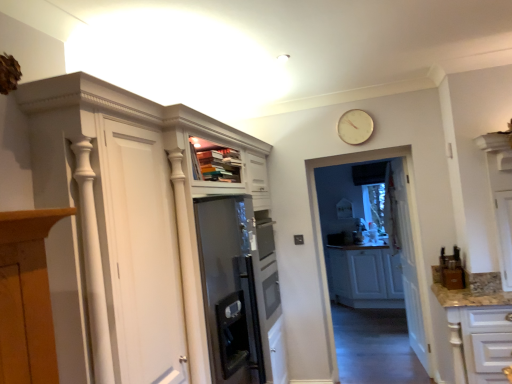
Question: Is transparent glass door at center oriented towards white glossy cupboard at upper left?

Choices:
 (A) yes
 (B) no

Answer: (B)

Question: Is the depth of transparent glass door at center less than that of white glossy cupboard at upper left?

Choices:
 (A) no
 (B) yes

Answer: (A)

Question: Is transparent glass door at center smaller than white glossy cupboard at upper left?

Choices:
 (A) no
 (B) yes

Answer: (B)

Question: From a real-world perspective, is transparent glass door at center located beneath white glossy cupboard at upper left?

Choices:
 (A) yes
 (B) no

Answer: (A)

Question: Is transparent glass door at center completely or partially outside of white glossy cupboard at upper left?

Choices:
 (A) yes
 (B) no

Answer: (A)

Question: Can you confirm if transparent glass door at center is positioned to the right of white glossy cupboard at upper left?

Choices:
 (A) yes
 (B) no

Answer: (A)

Question: Considering the relative sizes of white glossy cabinet at lower right, positioned as the second cabinetry in back-to-front order, and white glossy cupboard at upper left in the image provided, is white glossy cabinet at lower right, positioned as the second cabinetry in back-to-front order, shorter than white glossy cupboard at upper left?

Choices:
 (A) no
 (B) yes

Answer: (B)

Question: Does white glossy cabinet at lower right, positioned as the second cabinetry in back-to-front order, have a lesser width compared to white glossy cupboard at upper left?

Choices:
 (A) no
 (B) yes

Answer: (A)

Question: From a real-world perspective, is white glossy cabinet at lower right, the 1th cabinetry when ordered from front to back, beneath white glossy cupboard at upper left?

Choices:
 (A) no
 (B) yes

Answer: (B)

Question: Considering the relative sizes of white glossy cabinet at lower right, positioned as the second cabinetry in back-to-front order, and white glossy cupboard at upper left in the image provided, is white glossy cabinet at lower right, positioned as the second cabinetry in back-to-front order, wider than white glossy cupboard at upper left?

Choices:
 (A) no
 (B) yes

Answer: (B)

Question: From a real-world perspective, is white glossy cabinet at lower right, the 1th cabinetry when ordered from front to back, over white glossy cupboard at upper left?

Choices:
 (A) yes
 (B) no

Answer: (B)

Question: Are white glossy cabinet at lower right, the 1th cabinetry when ordered from front to back, and white glossy cupboard at upper left far apart?

Choices:
 (A) no
 (B) yes

Answer: (B)

Question: From the image's perspective, is white matte cabinet at center, the second cabinetry from the front, located above white glossy cabinet at lower right, the 1th cabinetry when ordered from front to back?

Choices:
 (A) no
 (B) yes

Answer: (A)